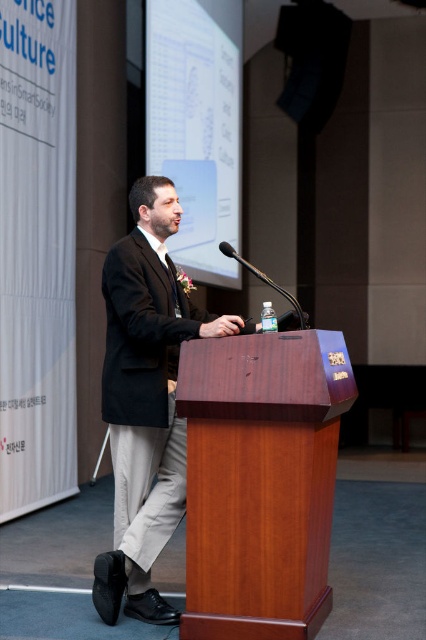
Describe the element at coordinates (261, 481) in the screenshot. I see `wooden podium at center` at that location.

Between wooden podium at center and matte black suit at center, which one has less height?

wooden podium at center

Which is behind, point (271, 397) or point (98, 604)?

Positioned behind is point (98, 604).

Locate an element on the screen. The width and height of the screenshot is (426, 640). wooden podium at center is located at coordinates (261, 481).

Can you confirm if wooden podium at center is smaller than metallic silver microphone at center?

No, wooden podium at center is not smaller than metallic silver microphone at center.

Who is shorter, wooden podium at center or metallic silver microphone at center?

metallic silver microphone at center is shorter.

Find the location of a particular element. The height and width of the screenshot is (640, 426). wooden podium at center is located at coordinates (261, 481).

Which is more to the left, matte black suit at center or metallic silver microphone at center?

Positioned to the left is matte black suit at center.

Which is above, matte black suit at center or metallic silver microphone at center?

metallic silver microphone at center is above.

Find the location of a particular element. The height and width of the screenshot is (640, 426). matte black suit at center is located at coordinates (146, 401).